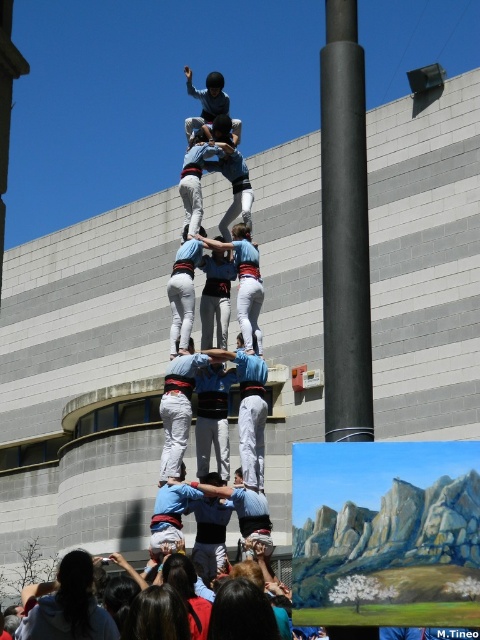
Question: Can you confirm if white cotton pants at center is positioned above light blue fabric shirt at center?

Choices:
 (A) no
 (B) yes

Answer: (A)

Question: Which object is positioned farthest from the white cotton pants at center?

Choices:
 (A) black smooth pole at center
 (B) light blue fabric shirt at center

Answer: (B)

Question: Which point is farther from the camera taking this photo?

Choices:
 (A) (171, 388)
 (B) (202, 152)
 (C) (356, 33)
 (D) (194, 93)

Answer: (D)

Question: Can you confirm if black smooth pole at center is smaller than light blue fabric at center?

Choices:
 (A) no
 (B) yes

Answer: (A)

Question: Among these points, which one is nearest to the camera?

Choices:
 (A) (196, 125)
 (B) (190, 227)
 (C) (197, 369)

Answer: (C)

Question: Can you confirm if light blue fabric at center is thinner than light blue fabric shirt at center?

Choices:
 (A) no
 (B) yes

Answer: (B)